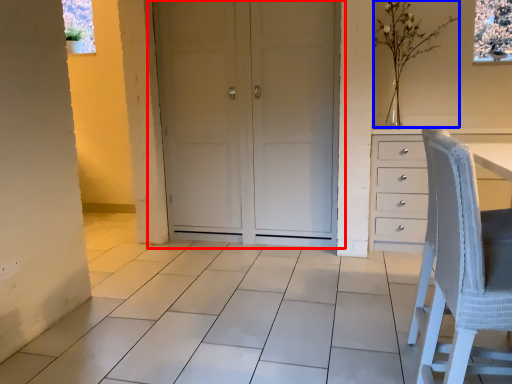
Question: Which of the following is the closest to the observer, door (highlighted by a red box) or flower (highlighted by a blue box)?

Choices:
 (A) door
 (B) flower

Answer: (A)